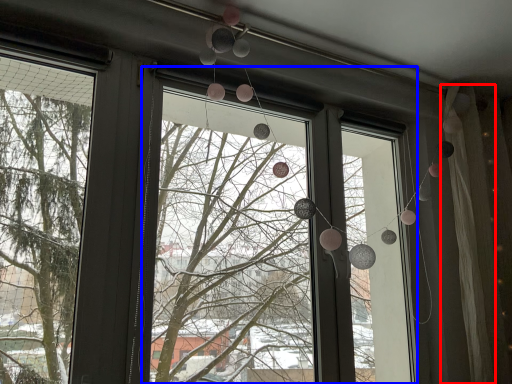
Question: Which point is further to the camera, curtain (highlighted by a red box) or shop window (highlighted by a blue box)?

Choices:
 (A) curtain
 (B) shop window

Answer: (A)